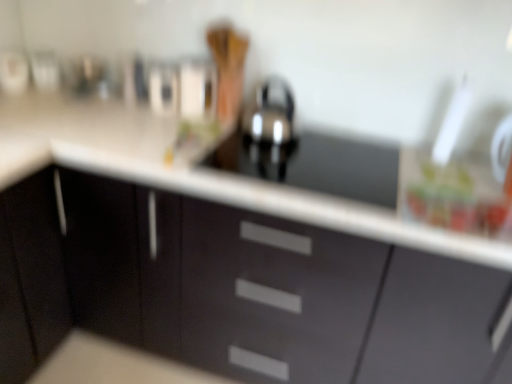
Question: From the image's perspective, is black glossy sink at center located above matte black cabinets at center?

Choices:
 (A) no
 (B) yes

Answer: (B)

Question: Can you see black glossy sink at center touching matte black cabinets at center?

Choices:
 (A) yes
 (B) no

Answer: (B)

Question: Considering the relative positions of black glossy sink at center and matte black cabinets at center in the image provided, is black glossy sink at center to the right of matte black cabinets at center from the viewer's perspective?

Choices:
 (A) no
 (B) yes

Answer: (B)

Question: Is black glossy sink at center taller than matte black cabinets at center?

Choices:
 (A) no
 (B) yes

Answer: (A)

Question: Considering the relative sizes of black glossy sink at center and matte black cabinets at center in the image provided, is black glossy sink at center thinner than matte black cabinets at center?

Choices:
 (A) no
 (B) yes

Answer: (B)

Question: From a real-world perspective, is black glossy sink at center located beneath matte black cabinets at center?

Choices:
 (A) yes
 (B) no

Answer: (B)

Question: Is matte black cabinets at center not within black glossy sink at center?

Choices:
 (A) yes
 (B) no

Answer: (A)

Question: Would you consider matte black cabinets at center to be distant from black glossy sink at center?

Choices:
 (A) no
 (B) yes

Answer: (A)

Question: Is matte black cabinets at center to the right of black glossy sink at center from the viewer's perspective?

Choices:
 (A) no
 (B) yes

Answer: (A)

Question: From the image's perspective, is matte black cabinets at center on black glossy sink at center?

Choices:
 (A) no
 (B) yes

Answer: (A)

Question: Is matte black cabinets at center aimed at black glossy sink at center?

Choices:
 (A) yes
 (B) no

Answer: (B)

Question: Considering the relative sizes of matte black cabinets at center and black glossy sink at center in the image provided, is matte black cabinets at center thinner than black glossy sink at center?

Choices:
 (A) no
 (B) yes

Answer: (A)

Question: From their relative heights in the image, would you say matte black cabinets at center is taller or shorter than black glossy sink at center?

Choices:
 (A) tall
 (B) short

Answer: (A)